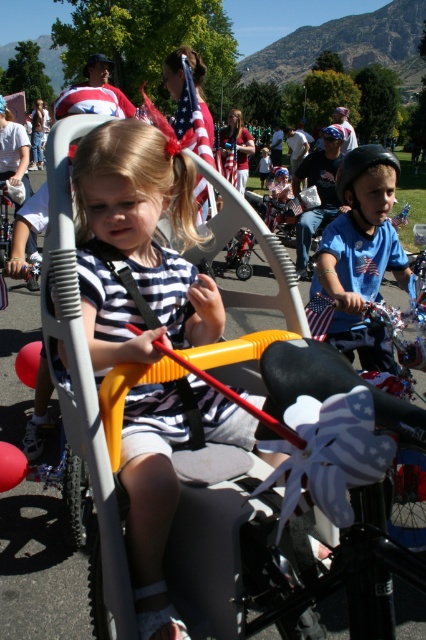
Question: Does striped fabric shirt at center appear over blue matte shirt at center?

Choices:
 (A) yes
 (B) no

Answer: (B)

Question: Is striped fabric shirt at center smaller than blue matte shirt at center?

Choices:
 (A) no
 (B) yes

Answer: (B)

Question: Is striped fabric shirt at center to the left of blue matte shirt at center from the viewer's perspective?

Choices:
 (A) no
 (B) yes

Answer: (B)

Question: Which point is closer to the camera?

Choices:
 (A) (106, 129)
 (B) (337, 289)

Answer: (A)

Question: Among these points, which one is farthest from the camera?

Choices:
 (A) (169, 412)
 (B) (322, 273)

Answer: (B)